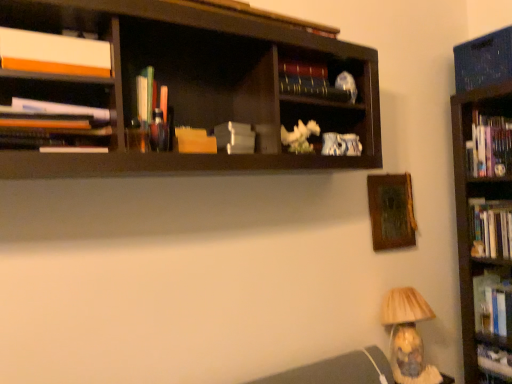
Image resolution: width=512 pixels, height=384 pixels. Describe the element at coordinates (490, 228) in the screenshot. I see `hardcover books at right, placed as the 4th book when sorted from bottom to top` at that location.

The image size is (512, 384). Describe the element at coordinates (54, 53) in the screenshot. I see `white matte book at upper left, which is the third book from top to bottom` at that location.

Image resolution: width=512 pixels, height=384 pixels. Identify the location of white matte book at upper left, which is the third book from top to bottom. (54, 53).

How much space does translucent plastic pens at center, which appears as the seventh book when ordered from the bottom, occupy horizontally?

It is 7.46 centimeters.

In order to click on hardcover books at right, which is the fourth book in top-to-bottom order in this screenshot , I will do `click(489, 146)`.

What do you see at coordinates (262, 15) in the screenshot? The width and height of the screenshot is (512, 384). I see `hardcover book at upper center, positioned as the first book in top-to-bottom order` at bounding box center [262, 15].

Where is `hardcover books at right, the eighth book from the top`? This screenshot has height=384, width=512. hardcover books at right, the eighth book from the top is located at coordinates (490, 228).

Can translucent plastic pens at center, which appears as the seventh book when ordered from the bottom, be found inside hardcover book at center, marked as the 11th book in a top-to-bottom arrangement?

That's incorrect, translucent plastic pens at center, which appears as the seventh book when ordered from the bottom, is not inside hardcover book at center, marked as the 11th book in a top-to-bottom arrangement.

Between point (484, 358) and point (138, 103), which one is positioned behind?

The point (484, 358) is farther from the camera.

How many degrees apart are the facing directions of hardcover book at center, marked as the 11th book in a top-to-bottom arrangement, and translucent plastic pens at center, the fifth book positioned from the top?

91.9 degrees separate the facing orientations of hardcover book at center, marked as the 11th book in a top-to-bottom arrangement, and translucent plastic pens at center, the fifth book positioned from the top.

Is hardcover book at center, marked as the 11th book in a top-to-bottom arrangement, taller than translucent plastic pens at center, the fifth book positioned from the top?

Incorrect, the height of hardcover book at center, marked as the 11th book in a top-to-bottom arrangement, is not larger of that of translucent plastic pens at center, the fifth book positioned from the top.

Based on their sizes in the image, would you say yellow paper at center, the fifth book in the bottom-to-top sequence, is bigger or smaller than matte beige lampshade at lower right?

In the image, yellow paper at center, the fifth book in the bottom-to-top sequence, appears to be smaller than matte beige lampshade at lower right.

Is yellow paper at center, the seventh book in the top-to-bottom sequence, taller than matte beige lampshade at lower right?

No, yellow paper at center, the seventh book in the top-to-bottom sequence, is not taller than matte beige lampshade at lower right.

The height and width of the screenshot is (384, 512). In order to click on the 2nd book in front of the matte beige lampshade at lower right in this screenshot , I will do `click(194, 141)`.

Does yellow paper at center, the fifth book in the bottom-to-top sequence, have a greater width compared to matte beige lampshade at lower right?

No, yellow paper at center, the fifth book in the bottom-to-top sequence, is not wider than matte beige lampshade at lower right.

Which object is positioned more to the right, matte beige lampshade at lower right or hardcover book at upper center, positioned as the first book in top-to-bottom order?

matte beige lampshade at lower right is more to the right.

From a real-world perspective, is matte beige lampshade at lower right positioned over hardcover book at upper center, which is the 11th book in bottom-to-top order, based on gravity?

No, from a real-world perspective, matte beige lampshade at lower right is not above hardcover book at upper center, which is the 11th book in bottom-to-top order.

Is hardcover book at upper center, which is the 11th book in bottom-to-top order, inside matte beige lampshade at lower right?

Definitely not — hardcover book at upper center, which is the 11th book in bottom-to-top order, is not inside matte beige lampshade at lower right.

Are matte beige lampshade at lower right and hardcover book at upper center, positioned as the first book in top-to-bottom order, located far from each other?

matte beige lampshade at lower right is far away from hardcover book at upper center, positioned as the first book in top-to-bottom order.

From the image's perspective, is hardcover book at upper center, which is the 11th book in bottom-to-top order, located above or below hardcover book at lower right, the 10th book from the top?

hardcover book at upper center, which is the 11th book in bottom-to-top order, is situated higher than hardcover book at lower right, the 10th book from the top, in the image.

Does hardcover book at upper center, which is the 11th book in bottom-to-top order, lie in front of hardcover book at lower right, which is the second book from bottom to top?

Yes, the depth of hardcover book at upper center, which is the 11th book in bottom-to-top order, is less than that of hardcover book at lower right, which is the second book from bottom to top.

From a real-world perspective, which object rests below the other?

hardcover book at lower right, which is the second book from bottom to top, is physically lower.

Considering the sizes of objects hardcover book at upper center, which is the 11th book in bottom-to-top order, and hardcover book at lower right, which is the second book from bottom to top, in the image provided, who is shorter, hardcover book at upper center, which is the 11th book in bottom-to-top order, or hardcover book at lower right, which is the second book from bottom to top,?

hardcover book at upper center, which is the 11th book in bottom-to-top order, is shorter.

From the image's perspective, which one is positioned higher, hardcover book at upper center, positioned as the 2th book in top-to-bottom order, or hardcover book at right, the 9th book when ordered from top to bottom?

From the image's view, hardcover book at upper center, positioned as the 2th book in top-to-bottom order, is above.

Is hardcover book at right, the 9th book when ordered from top to bottom, completely or partially inside hardcover book at upper center, the 10th book in the bottom-to-top sequence?

No, hardcover book at upper center, the 10th book in the bottom-to-top sequence, does not contain hardcover book at right, the 9th book when ordered from top to bottom.

Between hardcover book at upper center, the 10th book in the bottom-to-top sequence, and hardcover book at right, which ranks as the third book in bottom-to-top order, which one has less height?

With less height is hardcover book at upper center, the 10th book in the bottom-to-top sequence.

What's the angular difference between hardcover book at upper center, positioned as the 2th book in top-to-bottom order, and hardcover book at right, the 9th book when ordered from top to bottom,'s facing directions?

94.2 degrees separate the facing orientations of hardcover book at upper center, positioned as the 2th book in top-to-bottom order, and hardcover book at right, the 9th book when ordered from top to bottom.

From the image's perspective, is yellow paper at center, the fifth book in the bottom-to-top sequence, over wooden picture frame at upper right?

Yes.

Which is more to the left, yellow paper at center, the fifth book in the bottom-to-top sequence, or wooden picture frame at upper right?

From the viewer's perspective, yellow paper at center, the fifth book in the bottom-to-top sequence, appears more on the left side.

From a real-world perspective, which is physically above, yellow paper at center, the seventh book in the top-to-bottom sequence, or wooden picture frame at upper right?

From a 3D spatial view, yellow paper at center, the seventh book in the top-to-bottom sequence, is above.

Would you say yellow paper at center, the seventh book in the top-to-bottom sequence, is inside or outside wooden picture frame at upper right?

yellow paper at center, the seventh book in the top-to-bottom sequence, is not inside wooden picture frame at upper right, it's outside.

There is a wooden picture frame at upper right. Identify the location of the 4th book above it (from the image's perspective). This screenshot has width=512, height=384. (489, 146).

Considering the sizes of wooden picture frame at upper right and hardcover books at right, which is the fourth book in top-to-bottom order, in the image, is wooden picture frame at upper right wider or thinner than hardcover books at right, which is the fourth book in top-to-bottom order,?

wooden picture frame at upper right is thinner than hardcover books at right, which is the fourth book in top-to-bottom order.

Between wooden picture frame at upper right and hardcover books at right, which is the fourth book in top-to-bottom order, which one has larger size?

With larger size is hardcover books at right, which is the fourth book in top-to-bottom order.

Starting from the translucent plastic pens at center, the fifth book positioned from the top, which book is the 6th one to the right? Please provide its 2D coordinates.

[(494, 360)]

Image resolution: width=512 pixels, height=384 pixels. I want to click on the 3rd book positioned above the matte beige lampshade at lower right (from a real-world perspective), so click(194, 141).

Considering their positions, is hardcover book at center, marked as the 11th book in a top-to-bottom arrangement, positioned further to hardcover book at lower right, which is the second book from bottom to top, than hardcover books at right, the 8th book from the bottom?

Among the two, hardcover books at right, the 8th book from the bottom, is located further to hardcover book at lower right, which is the second book from bottom to top.

Based on their spatial positions, is hardcover book at upper center, the 10th book in the bottom-to-top sequence, or hardcover book at upper center, positioned as the first book in top-to-bottom order, further from wooden picture frame at upper right?

Based on the image, hardcover book at upper center, positioned as the first book in top-to-bottom order, appears to be further to wooden picture frame at upper right.

Based on their spatial positions, is wooden picture frame at upper right or hardcover book at upper center, which is the 11th book in bottom-to-top order, further from hardcover book at center, which is the first book from bottom to top?

hardcover book at upper center, which is the 11th book in bottom-to-top order, is further to hardcover book at center, which is the first book from bottom to top.

Estimate the real-world distances between objects in this image. Which object is further from hardcover book at lower right, which is the second book from bottom to top, white matte paper at center or hardcover book at center, marked as the 11th book in a top-to-bottom arrangement?

white matte paper at center lies further to hardcover book at lower right, which is the second book from bottom to top, than the other object.

Which object lies further to the anchor point matte white papers at left, which ranks as the sixth book in top-to-bottom order, hardcover book at right, which ranks as the third book in bottom-to-top order, or hardcover book at center, which is the first book from bottom to top?

hardcover book at center, which is the first book from bottom to top, is positioned further to the anchor matte white papers at left, which ranks as the sixth book in top-to-bottom order.

When comparing their distances from matte white papers at left, which is the 6th book from bottom to top, does hardcover books at right, which is the fourth book in top-to-bottom order, or hardcover book at lower right, the 10th book from the top, seem further?

Among the two, hardcover book at lower right, the 10th book from the top, is located further to matte white papers at left, which is the 6th book from bottom to top.

From the image, which object appears to be nearer to hardcover books at right, which is the fourth book in top-to-bottom order, wooden picture frame at upper right or matte beige lampshade at lower right?

wooden picture frame at upper right lies closer to hardcover books at right, which is the fourth book in top-to-bottom order, than the other object.

Based on their spatial positions, is hardcover books at right, the 8th book from the bottom, or wooden picture frame at upper right further from white matte book at upper left, which is the third book from top to bottom?

Based on the image, hardcover books at right, the 8th book from the bottom, appears to be further to white matte book at upper left, which is the third book from top to bottom.

At what (x,y) coordinates should I click in order to perform the action: click on lamp between white matte book at upper left, the ninth book in the bottom-to-top sequence, and hardcover book at lower right, which is the second book from bottom to top, in the horizontal direction. Please return your answer as a coordinate pair (x, y). The height and width of the screenshot is (384, 512). Looking at the image, I should click on (407, 336).

Image resolution: width=512 pixels, height=384 pixels. In order to click on lamp situated between translucent plastic pens at center, the fifth book positioned from the top, and hardcover book at center, marked as the 11th book in a top-to-bottom arrangement, from left to right in this screenshot , I will do `click(407, 336)`.

At what (x,y) coordinates should I click in order to perform the action: click on paperback book between translucent plastic pens at center, which appears as the seventh book when ordered from the bottom, and hardcover book at upper center, positioned as the 2th book in top-to-bottom order, from left to right. Please return your answer as a coordinate pair (x, y). This screenshot has height=384, width=512. Looking at the image, I should click on (234, 138).

Where is `picture frame between translucent plastic pens at center, the fifth book positioned from the top, and hardcover books at right, the eighth book from the top, from left to right`? This screenshot has height=384, width=512. picture frame between translucent plastic pens at center, the fifth book positioned from the top, and hardcover books at right, the eighth book from the top, from left to right is located at coordinates (391, 211).